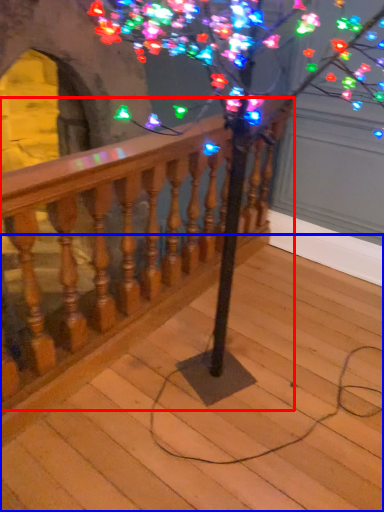
Question: Which object appears closest to the camera in this image, rail (highlighted by a red box) or stairs (highlighted by a blue box)?

Choices:
 (A) rail
 (B) stairs

Answer: (B)